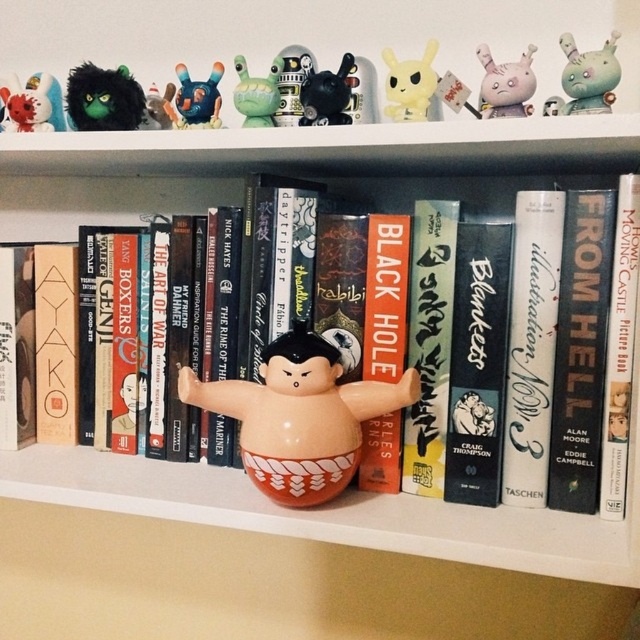
You are organizing a shelf and see the matte white figurine at upper left and the matte green plastic toy at upper center. Which object is positioned more to the left side of the shelf?

The matte white figurine at upper left is positioned more to the left side of the shelf than the matte green plastic toy at upper center.

You are a collector of small figurines and want to display them on a shelf. You have two figurines in front of you, the glossy ceramic sumo wrestler at center and the yellow matte pikachu at upper center. Which one is taller?

The glossy ceramic sumo wrestler at center is much taller than the yellow matte pikachu at upper center.

You are organizing a shelf and need to move the matte white figurine at upper left and the matte green plastic toy at upper center. Which object is blocking the other from being moved first?

The matte green plastic toy at upper center is behind the matte white figurine at upper left, so the matte white figurine at upper left is blocking the matte green plastic toy at upper center. You need to move the matte white figurine at upper left first to access the matte green plastic toy at upper center.